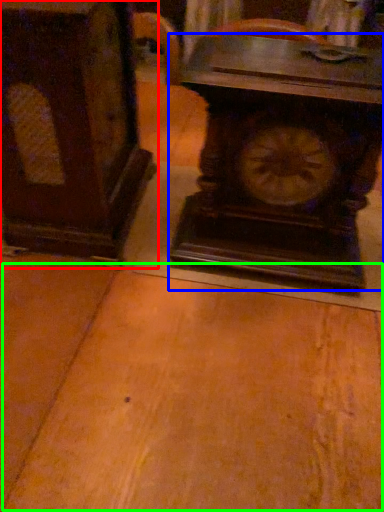
Question: Estimate the real-world distances between objects in this image. Which object is closer to furniture (highlighted by a red box), wall clock (highlighted by a blue box) or table (highlighted by a green box)?

Choices:
 (A) wall clock
 (B) table

Answer: (A)